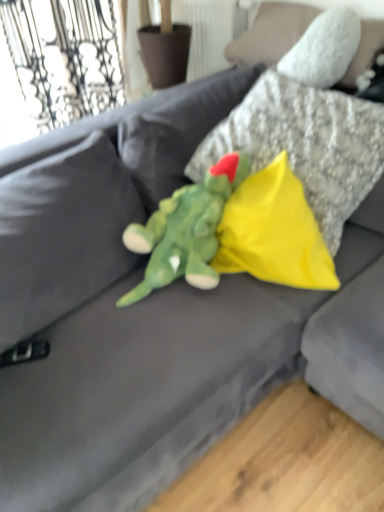
The height and width of the screenshot is (512, 384). Describe the element at coordinates (274, 232) in the screenshot. I see `yellow fabric pillow at center, positioned as the 1th pillow in bottom-to-top order` at that location.

The height and width of the screenshot is (512, 384). What are the coordinates of `yellow fabric pillow at center, the 2th pillow from the bottom` in the screenshot? It's located at (305, 144).

Identify the location of soft plush dinosaur at center. (185, 230).

Image resolution: width=384 pixels, height=512 pixels. What do you see at coordinates (185, 230) in the screenshot? I see `soft plush dinosaur at center` at bounding box center [185, 230].

This screenshot has height=512, width=384. Identify the location of yellow fabric pillow at center, which is counted as the second pillow, starting from the top. (274, 232).

Is point (198, 265) positioned behind point (279, 246)?

That is False.

From their relative heights in the image, would you say soft plush dinosaur at center is taller or shorter than yellow fabric pillow at center, positioned as the 1th pillow in bottom-to-top order?

Considering their sizes, soft plush dinosaur at center has less height than yellow fabric pillow at center, positioned as the 1th pillow in bottom-to-top order.

From a real-world perspective, between soft plush dinosaur at center and yellow fabric pillow at center, positioned as the 1th pillow in bottom-to-top order, who is vertically lower?

yellow fabric pillow at center, positioned as the 1th pillow in bottom-to-top order, is physically lower.

Where is `the 1st pillow counting from the right of the soft plush dinosaur at center`? the 1st pillow counting from the right of the soft plush dinosaur at center is located at coordinates (274, 232).

Which object is further away from the camera taking this photo, yellow fabric pillow at center, which is counted as the second pillow, starting from the top, or yellow fabric pillow at center, the 2th pillow from the bottom?

yellow fabric pillow at center, which is counted as the second pillow, starting from the top.

How different are the orientations of yellow fabric pillow at center, positioned as the 1th pillow in bottom-to-top order, and yellow fabric pillow at center, the 2th pillow from the bottom, in degrees?

22.9 degrees.

From a real-world perspective, is yellow fabric pillow at center, which is counted as the second pillow, starting from the top, above or below yellow fabric pillow at center, the 1th pillow viewed from the top?

From a real-world perspective, yellow fabric pillow at center, which is counted as the second pillow, starting from the top, is physically below yellow fabric pillow at center, the 1th pillow viewed from the top.

Does soft plush dinosaur at center have a greater height compared to yellow fabric pillow at center, the 2th pillow from the bottom?

In fact, soft plush dinosaur at center may be shorter than yellow fabric pillow at center, the 2th pillow from the bottom.

Could you tell me if soft plush dinosaur at center is turned towards yellow fabric pillow at center, the 2th pillow from the bottom?

No.

From the image's perspective, is soft plush dinosaur at center on yellow fabric pillow at center, the 2th pillow from the bottom?

Actually, soft plush dinosaur at center appears below yellow fabric pillow at center, the 2th pillow from the bottom, in the image.

Does soft plush dinosaur at center contain yellow fabric pillow at center, the 1th pillow viewed from the top?

No, yellow fabric pillow at center, the 1th pillow viewed from the top, is located outside of soft plush dinosaur at center.

Which is closer to the camera, (373, 160) or (286, 161)?

Positioned in front is point (286, 161).

Can you tell me how much yellow fabric pillow at center, the 2th pillow from the bottom, and yellow fabric pillow at center, which is counted as the second pillow, starting from the top, differ in facing direction?

The angle between the facing direction of yellow fabric pillow at center, the 2th pillow from the bottom, and the facing direction of yellow fabric pillow at center, which is counted as the second pillow, starting from the top, is 22.9 degrees.

Considering the relative positions of yellow fabric pillow at center, the 2th pillow from the bottom, and yellow fabric pillow at center, positioned as the 1th pillow in bottom-to-top order, in the image provided, is yellow fabric pillow at center, the 2th pillow from the bottom, behind yellow fabric pillow at center, positioned as the 1th pillow in bottom-to-top order,?

That is False.

Considering the relative sizes of yellow fabric pillow at center, the 2th pillow from the bottom, and yellow fabric pillow at center, positioned as the 1th pillow in bottom-to-top order, in the image provided, is yellow fabric pillow at center, the 2th pillow from the bottom, taller than yellow fabric pillow at center, positioned as the 1th pillow in bottom-to-top order,?

Indeed, yellow fabric pillow at center, the 2th pillow from the bottom, has a greater height compared to yellow fabric pillow at center, positioned as the 1th pillow in bottom-to-top order.

Is yellow fabric pillow at center, positioned as the 1th pillow in bottom-to-top order, bigger or smaller than soft plush dinosaur at center?

In the image, yellow fabric pillow at center, positioned as the 1th pillow in bottom-to-top order, appears to be smaller than soft plush dinosaur at center.

Between yellow fabric pillow at center, which is counted as the second pillow, starting from the top, and soft plush dinosaur at center, which one appears on the left side from the viewer's perspective?

soft plush dinosaur at center.

What's the angular difference between yellow fabric pillow at center, positioned as the 1th pillow in bottom-to-top order, and soft plush dinosaur at center's facing directions?

There is a 69.7-degree angle between the facing directions of yellow fabric pillow at center, positioned as the 1th pillow in bottom-to-top order, and soft plush dinosaur at center.

From the picture: Which point is more forward, [258,259] or [191,247]?

Positioned in front is point [258,259].

Does yellow fabric pillow at center, the 1th pillow viewed from the top, lie behind soft plush dinosaur at center?

Yes, it is.

Choose the correct answer: Is yellow fabric pillow at center, the 1th pillow viewed from the top, inside soft plush dinosaur at center or outside it?

yellow fabric pillow at center, the 1th pillow viewed from the top, lies outside soft plush dinosaur at center.

In the scene shown: Are yellow fabric pillow at center, the 2th pillow from the bottom, and soft plush dinosaur at center located far from each other?

No, there isn't a large distance between yellow fabric pillow at center, the 2th pillow from the bottom, and soft plush dinosaur at center.

Considering the sizes of objects yellow fabric pillow at center, the 2th pillow from the bottom, and soft plush dinosaur at center in the image provided, who is smaller, yellow fabric pillow at center, the 2th pillow from the bottom, or soft plush dinosaur at center?

Smaller between the two is soft plush dinosaur at center.

At what (x,y) coordinates should I click in order to perform the action: click on pillow below the soft plush dinosaur at center (from a real-world perspective). Please return your answer as a coordinate pair (x, y). The width and height of the screenshot is (384, 512). Looking at the image, I should click on (274, 232).

Find the location of a particular element. The height and width of the screenshot is (512, 384). pillow in front of the yellow fabric pillow at center, positioned as the 1th pillow in bottom-to-top order is located at coordinates (305, 144).

From the image, which object appears to be farther from yellow fabric pillow at center, the 2th pillow from the bottom, yellow fabric pillow at center, which is counted as the second pillow, starting from the top, or soft plush dinosaur at center?

The object further to yellow fabric pillow at center, the 2th pillow from the bottom, is soft plush dinosaur at center.

Looking at the image, which one is located further to soft plush dinosaur at center, yellow fabric pillow at center, which is counted as the second pillow, starting from the top, or yellow fabric pillow at center, the 1th pillow viewed from the top?

yellow fabric pillow at center, the 1th pillow viewed from the top, lies further to soft plush dinosaur at center than the other object.

Which object lies further to the anchor point yellow fabric pillow at center, the 2th pillow from the bottom, soft plush dinosaur at center or yellow fabric pillow at center, which is counted as the second pillow, starting from the top?

soft plush dinosaur at center is positioned further to the anchor yellow fabric pillow at center, the 2th pillow from the bottom.

Which object lies further to the anchor point yellow fabric pillow at center, positioned as the 1th pillow in bottom-to-top order, yellow fabric pillow at center, the 2th pillow from the bottom, or soft plush dinosaur at center?

yellow fabric pillow at center, the 2th pillow from the bottom.

From the image, which object appears to be nearer to soft plush dinosaur at center, yellow fabric pillow at center, the 2th pillow from the bottom, or yellow fabric pillow at center, which is counted as the second pillow, starting from the top?

yellow fabric pillow at center, which is counted as the second pillow, starting from the top.

From the picture: Estimate the real-world distances between objects in this image. Which object is closer to yellow fabric pillow at center, which is counted as the second pillow, starting from the top, soft plush dinosaur at center or yellow fabric pillow at center, the 1th pillow viewed from the top?

The object closer to yellow fabric pillow at center, which is counted as the second pillow, starting from the top, is soft plush dinosaur at center.

Where is `pillow between soft plush dinosaur at center and yellow fabric pillow at center, the 1th pillow viewed from the top, from left to right`? This screenshot has height=512, width=384. pillow between soft plush dinosaur at center and yellow fabric pillow at center, the 1th pillow viewed from the top, from left to right is located at coordinates (274, 232).